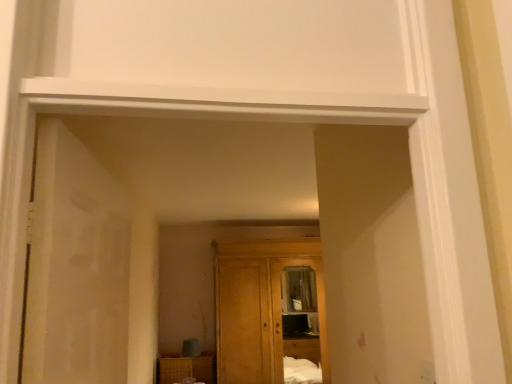
Question: From a real-world perspective, is white matte door at left positioned under woven wood cabinet at lower center based on gravity?

Choices:
 (A) yes
 (B) no

Answer: (B)

Question: Does white matte door at left lie behind woven wood cabinet at lower center?

Choices:
 (A) no
 (B) yes

Answer: (A)

Question: From the image's perspective, does white matte door at left appear higher than woven wood cabinet at lower center?

Choices:
 (A) no
 (B) yes

Answer: (B)

Question: Does white matte door at left have a larger size compared to woven wood cabinet at lower center?

Choices:
 (A) no
 (B) yes

Answer: (A)

Question: Does white matte door at left have a lesser width compared to woven wood cabinet at lower center?

Choices:
 (A) no
 (B) yes

Answer: (B)

Question: From their relative heights in the image, would you say white matte door at left is taller or shorter than woven wood cabinet at lower center?

Choices:
 (A) tall
 (B) short

Answer: (A)

Question: In terms of width, does white matte door at left look wider or thinner when compared to woven wood cabinet at lower center?

Choices:
 (A) thin
 (B) wide

Answer: (A)

Question: Choose the correct answer: Is white matte door at left inside woven wood cabinet at lower center or outside it?

Choices:
 (A) inside
 (B) outside

Answer: (B)

Question: From a real-world perspective, relative to woven wood cabinet at lower center, is white matte door at left vertically above or below?

Choices:
 (A) above
 (B) below

Answer: (A)

Question: Relative to wooden wardrobe at center, is woven wood cabinet at lower center in front or behind?

Choices:
 (A) front
 (B) behind

Answer: (B)

Question: In terms of height, does woven wood cabinet at lower center look taller or shorter compared to wooden wardrobe at center?

Choices:
 (A) short
 (B) tall

Answer: (A)

Question: From the image's perspective, relative to wooden wardrobe at center, is woven wood cabinet at lower center above or below?

Choices:
 (A) above
 (B) below

Answer: (B)

Question: Does point (205, 359) appear closer or farther from the camera than point (293, 249)?

Choices:
 (A) closer
 (B) farther

Answer: (A)

Question: Is white matte door at left taller or shorter than wooden wardrobe at center?

Choices:
 (A) short
 (B) tall

Answer: (A)

Question: From the image's perspective, relative to wooden wardrobe at center, is white matte door at left above or below?

Choices:
 (A) below
 (B) above

Answer: (B)